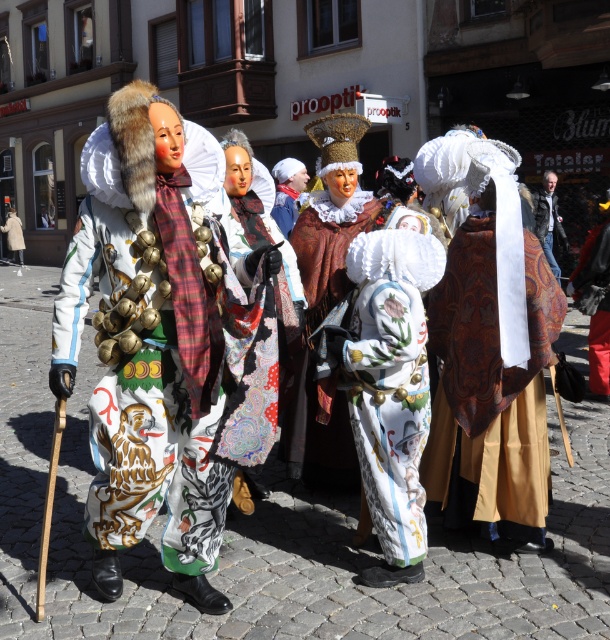
Is point (367, 440) farther from camera compared to point (603, 376)?

That is False.

Is point (364, 330) in front of point (578, 275)?

Yes, it is in front of point (578, 275).

Locate an element on the screen. white painted fabric costume at center is located at coordinates (390, 380).

Is white painted fabric costume at center wider than leather jacket at center?

No.

Is point (366, 298) closer to camera compared to point (547, 216)?

Yes, point (366, 298) is closer to viewer.

This screenshot has width=610, height=640. I want to click on white painted fabric costume at center, so click(x=390, y=380).

Does red velvet coat at center come behind leather jacket at center?

That is False.

Does red velvet coat at center have a larger size compared to leather jacket at center?

No, red velvet coat at center is not bigger than leather jacket at center.

Measure the distance between red velvet coat at center and camera.

red velvet coat at center and camera are 25.41 feet apart.

The width and height of the screenshot is (610, 640). I want to click on red velvet coat at center, so click(x=594, y=301).